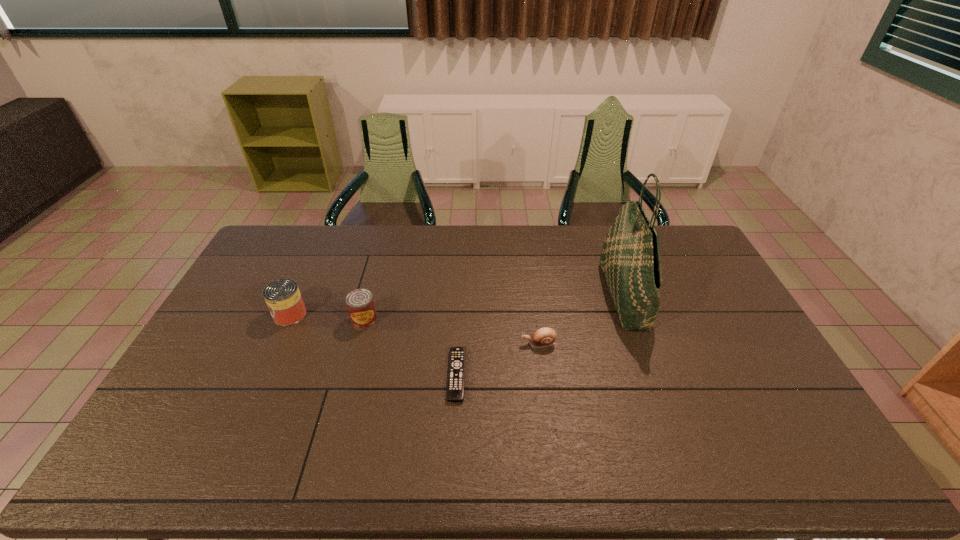
The height and width of the screenshot is (540, 960). I want to click on vacant space that satisfies the following two spatial constraints: 1. on the back side of the tallest object; 2. on the left side of the left can, so click(x=299, y=296).

Locate an element on the screen. free space that satisfies the following two spatial constraints: 1. on the back side of the tallest object; 2. on the left side of the remote control is located at coordinates click(461, 296).